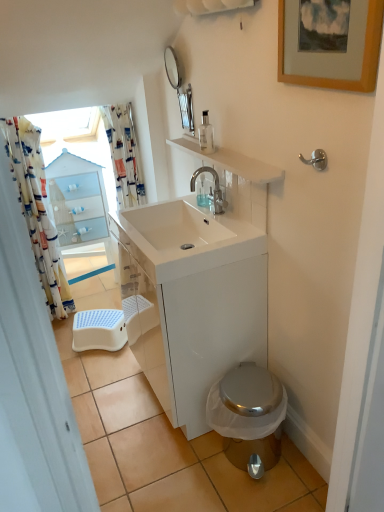
The width and height of the screenshot is (384, 512). What are the coordinates of `free space above blue plastic step stool at lower left (from a real-world perspective)` in the screenshot? It's located at pyautogui.click(x=95, y=320).